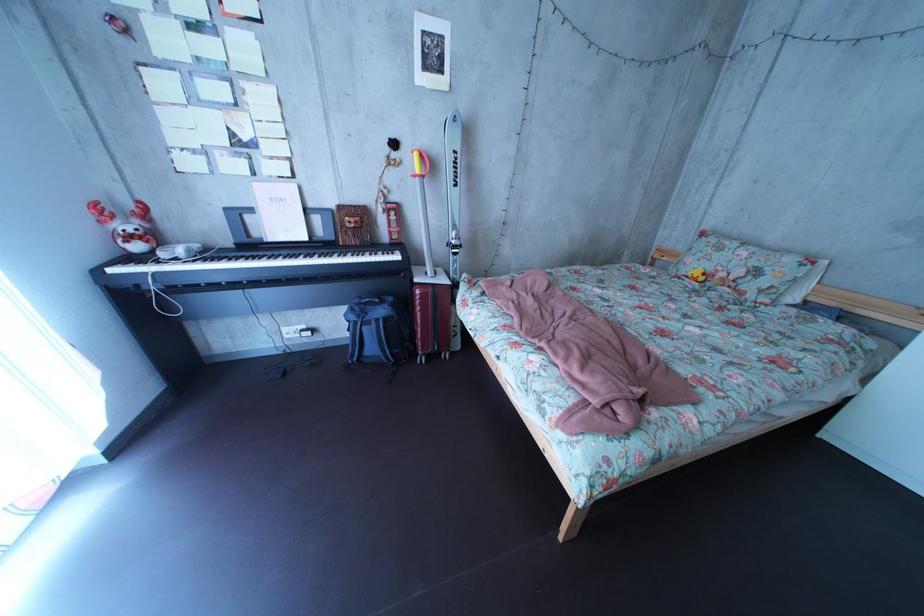
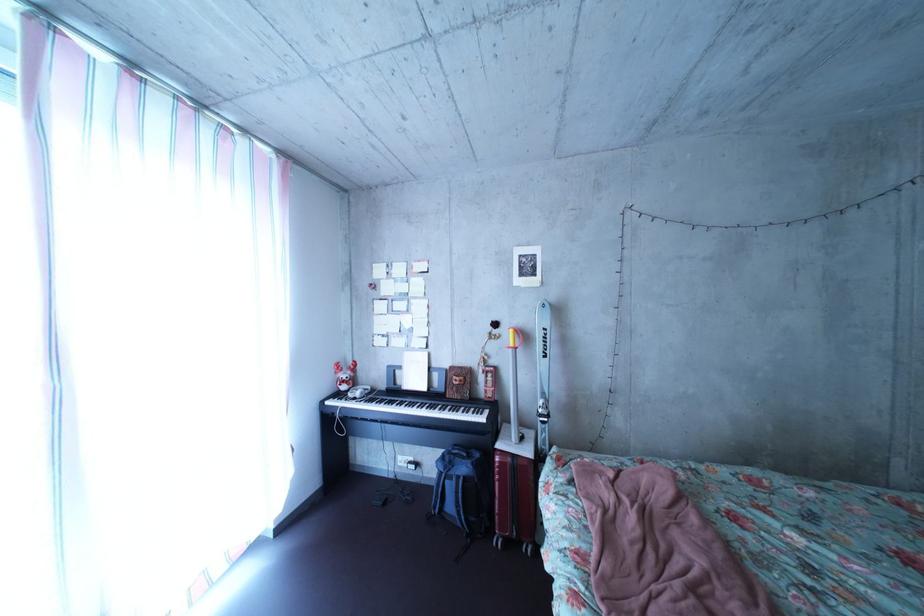
In the second image, find the point that corresponds to (x=334, y=241) in the first image.

(452, 392)